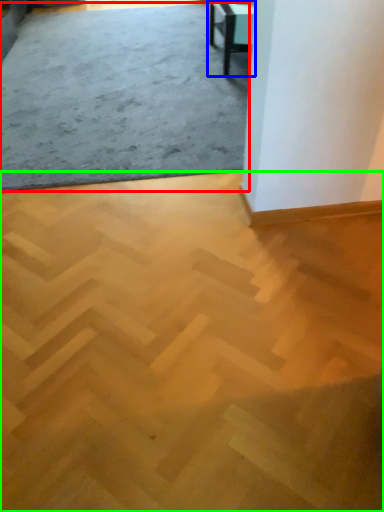
Question: Which is nearer to the concrete (highlighted by a red box)? table (highlighted by a blue box) or concrete (highlighted by a green box).

Choices:
 (A) table
 (B) concrete

Answer: (A)